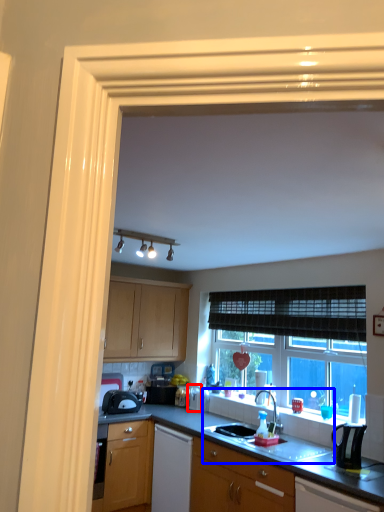
Question: Among these objects, which one is farthest to the camera, appliance (highlighted by a red box) or sink (highlighted by a blue box)?

Choices:
 (A) appliance
 (B) sink

Answer: (A)